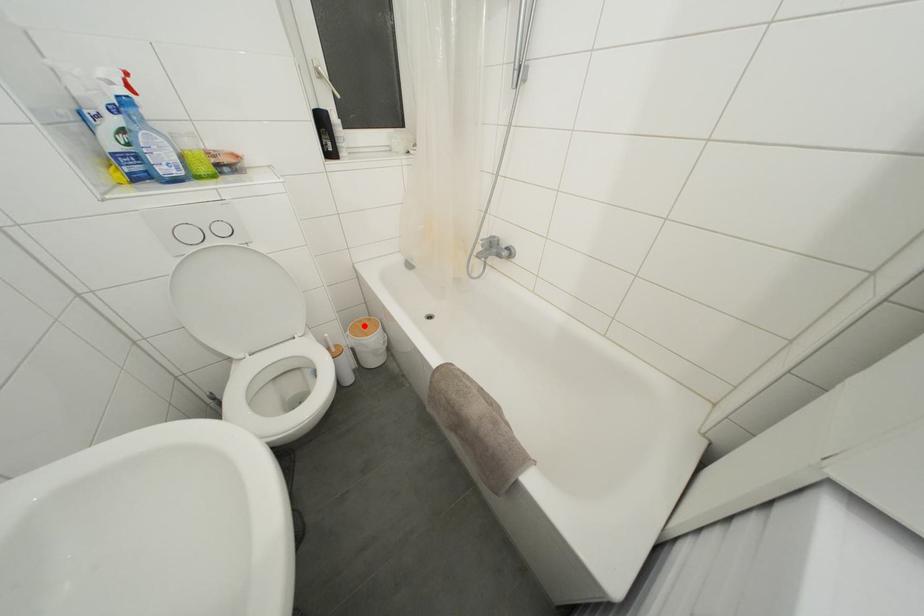
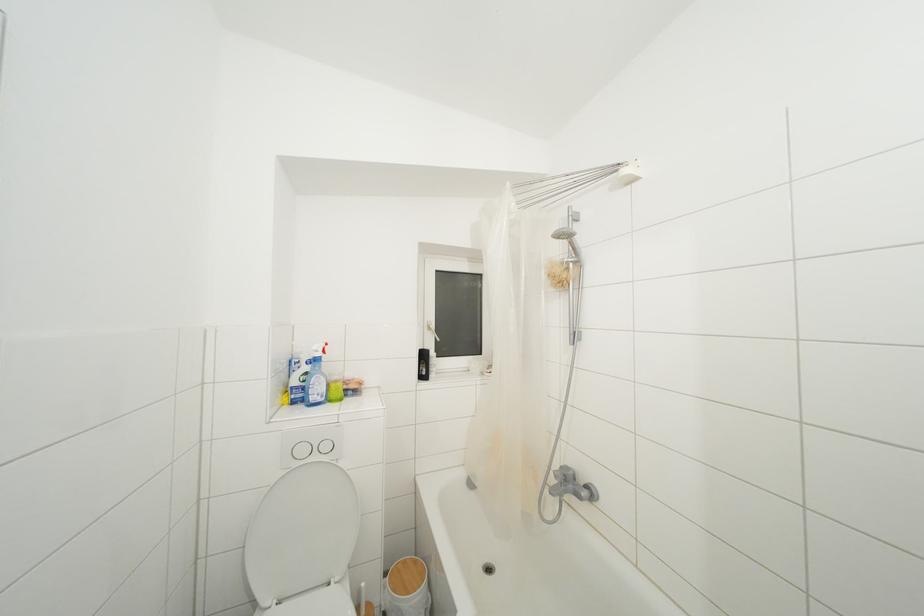
Question: I am providing you with two images of the same scene from different viewpoints. Given a red point in image1, look at the same physical point in image2. Is it:

Choices:
 (A) Closer to the viewpoint
 (B) Farther from the viewpoint

Answer: (B)